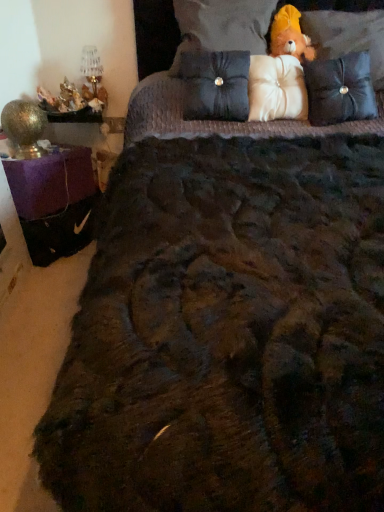
The width and height of the screenshot is (384, 512). Find the location of `velvet-like brown pillow at upper right, the fourth pillow positioned from the left`. velvet-like brown pillow at upper right, the fourth pillow positioned from the left is located at coordinates (340, 89).

Describe the element at coordinates (276, 88) in the screenshot. The image size is (384, 512). I see `white fabric pillow at center, acting as the 3th pillow starting from the left` at that location.

Locate an element on the screen. velvet black pillow at upper right, which ranks as the first pillow in right-to-left order is located at coordinates (348, 36).

Locate an element on the screen. fuzzy brown teddy bear at upper right is located at coordinates (290, 35).

Is white fabric pillow at center, acting as the 3th pillow starting from the left, facing away from fuzzy brown teddy bear at upper right?

white fabric pillow at center, acting as the 3th pillow starting from the left, does not have its back to fuzzy brown teddy bear at upper right.

Starting from the fuzzy brown teddy bear at upper right, which pillow is the 2nd one in front? Please provide its 2D coordinates.

[(276, 88)]

Can you confirm if white fabric pillow at center, acting as the 3th pillow starting from the left, is bigger than fuzzy brown teddy bear at upper right?

Yes.

From a real-world perspective, is white fabric pillow at center, the 3th pillow viewed from the right, above or below fuzzy brown teddy bear at upper right?

white fabric pillow at center, the 3th pillow viewed from the right, is situated lower than fuzzy brown teddy bear at upper right in the real world.

From a real-world perspective, between white fabric pillow at center, acting as the 3th pillow starting from the left, and velvet black pillow at upper right, which appears as the fifth pillow when viewed from the left, who is vertically lower?

From a 3D spatial view, white fabric pillow at center, acting as the 3th pillow starting from the left, is below.

Is white fabric pillow at center, the 3th pillow viewed from the right, positioned with its back to velvet black pillow at upper right, which ranks as the first pillow in right-to-left order?

No, white fabric pillow at center, the 3th pillow viewed from the right,'s orientation is not away from velvet black pillow at upper right, which ranks as the first pillow in right-to-left order.

Which of these two, white fabric pillow at center, acting as the 3th pillow starting from the left, or velvet black pillow at upper right, which appears as the fifth pillow when viewed from the left, stands taller?

velvet black pillow at upper right, which appears as the fifth pillow when viewed from the left, is taller.

From the image's perspective, is white fabric pillow at center, the 3th pillow viewed from the right, located above or below velvet black pillow at upper right, which appears as the fifth pillow when viewed from the left?

white fabric pillow at center, the 3th pillow viewed from the right, is below velvet black pillow at upper right, which appears as the fifth pillow when viewed from the left.

From a real-world perspective, is velvet black pillow at upper right, which appears as the fifth pillow when viewed from the left, physically above fuzzy brown teddy bear at upper right?

Actually, velvet black pillow at upper right, which appears as the fifth pillow when viewed from the left, is physically below fuzzy brown teddy bear at upper right in the real world.

Considering the sizes of velvet black pillow at upper right, which ranks as the first pillow in right-to-left order, and fuzzy brown teddy bear at upper right in the image, is velvet black pillow at upper right, which ranks as the first pillow in right-to-left order, taller or shorter than fuzzy brown teddy bear at upper right?

velvet black pillow at upper right, which ranks as the first pillow in right-to-left order, is taller than fuzzy brown teddy bear at upper right.

Which object is positioned more to the left, velvet black pillow at upper right, which ranks as the first pillow in right-to-left order, or fuzzy brown teddy bear at upper right?

From the viewer's perspective, fuzzy brown teddy bear at upper right appears more on the left side.

From the image's perspective, relative to velvet-like brown pillow at upper right, which is the second pillow in right-to-left order, is fuzzy brown teddy bear at upper right above or below?

From the image's perspective, fuzzy brown teddy bear at upper right appears above velvet-like brown pillow at upper right, which is the second pillow in right-to-left order.

From their relative heights in the image, would you say fuzzy brown teddy bear at upper right is taller or shorter than velvet-like brown pillow at upper right, the fourth pillow positioned from the left?

Considering their sizes, fuzzy brown teddy bear at upper right has less height than velvet-like brown pillow at upper right, the fourth pillow positioned from the left.

From the image's perspective, is velvet-like brown pillow at upper right, the fourth pillow positioned from the left, located above black quilted pillow at center, the first pillow viewed from the left?

No, from the image's perspective, velvet-like brown pillow at upper right, the fourth pillow positioned from the left, is not on top of black quilted pillow at center, the first pillow viewed from the left.

Where is `the 3rd pillow counting from the right side of the black quilted pillow at center, the first pillow viewed from the left`? Image resolution: width=384 pixels, height=512 pixels. the 3rd pillow counting from the right side of the black quilted pillow at center, the first pillow viewed from the left is located at coordinates click(340, 89).

Can you confirm if velvet-like brown pillow at upper right, the fourth pillow positioned from the left, is wider than black quilted pillow at center, the first pillow viewed from the left?

In fact, velvet-like brown pillow at upper right, the fourth pillow positioned from the left, might be narrower than black quilted pillow at center, the first pillow viewed from the left.

Is velvet-like brown pillow at upper right, the fourth pillow positioned from the left, taller than black quilted pillow at center, placed as the 5th pillow when sorted from right to left?

Correct, velvet-like brown pillow at upper right, the fourth pillow positioned from the left, is much taller as black quilted pillow at center, placed as the 5th pillow when sorted from right to left.

From the image's perspective, does velvet-like brown pillow at upper right, which is the second pillow in right-to-left order, appear higher than white fabric pillow at center, acting as the 3th pillow starting from the left?

No, from the image's perspective, velvet-like brown pillow at upper right, which is the second pillow in right-to-left order, is not above white fabric pillow at center, acting as the 3th pillow starting from the left.

Is velvet-like brown pillow at upper right, which is the second pillow in right-to-left order, facing away from white fabric pillow at center, the 3th pillow viewed from the right?

No, white fabric pillow at center, the 3th pillow viewed from the right, is not at the back of velvet-like brown pillow at upper right, which is the second pillow in right-to-left order.

Which of these two, velvet-like brown pillow at upper right, the fourth pillow positioned from the left, or white fabric pillow at center, the 3th pillow viewed from the right, is wider?

white fabric pillow at center, the 3th pillow viewed from the right.

Looking at this image, who is bigger, velvet-like brown pillow at upper right, which is the second pillow in right-to-left order, or velvet black pillow at upper right, which appears as the fifth pillow when viewed from the left?

With larger size is velvet black pillow at upper right, which appears as the fifth pillow when viewed from the left.

Considering the positions of point (352, 99) and point (382, 51), is point (352, 99) closer or farther from the camera than point (382, 51)?

Clearly, point (352, 99) is closer to the camera than point (382, 51).

Is velvet-like brown pillow at upper right, the fourth pillow positioned from the left, facing away from velvet black pillow at upper right, which appears as the fifth pillow when viewed from the left?

That's right, velvet-like brown pillow at upper right, the fourth pillow positioned from the left, is facing away from velvet black pillow at upper right, which appears as the fifth pillow when viewed from the left.

From a real-world perspective, which object rests below the other?

velvet-like brown pillow at upper right, which is the second pillow in right-to-left order, from a real-world perspective.

This screenshot has width=384, height=512. What are the coordinates of `figurine lying behind the white fabric pillow at center, the 3th pillow viewed from the right` in the screenshot? It's located at (290, 35).

What are the coordinates of `the 3rd pillow in front of the white fabric pillow at center, acting as the 3th pillow starting from the left` in the screenshot? It's located at (348, 36).

From the image, which object appears to be farther from black quilted pillow at center, the first pillow viewed from the left, white fabric pillow at center, acting as the 3th pillow starting from the left, or fuzzy brown teddy bear at upper right?

fuzzy brown teddy bear at upper right is further to black quilted pillow at center, the first pillow viewed from the left.

From the image, which object appears to be nearer to fuzzy brown teddy bear at upper right, velvet-like brown pillow at upper right, the fourth pillow positioned from the left, or velvet black pillow at upper right, which appears as the fifth pillow when viewed from the left?

velvet black pillow at upper right, which appears as the fifth pillow when viewed from the left, is closer to fuzzy brown teddy bear at upper right.

Based on their spatial positions, is fuzzy brown teddy bear at upper right or black quilted pillow at center, placed as the 5th pillow when sorted from right to left, further from white fabric pillow at center, acting as the 3th pillow starting from the left?

The object further to white fabric pillow at center, acting as the 3th pillow starting from the left, is fuzzy brown teddy bear at upper right.

Considering their positions, is black quilted pillow at center, placed as the 5th pillow when sorted from right to left, positioned closer to white fabric pillow at center, acting as the 3th pillow starting from the left, than velvet-like brown pillow at upper right, the fourth pillow positioned from the left?

Based on the image, black quilted pillow at center, placed as the 5th pillow when sorted from right to left, appears to be nearer to white fabric pillow at center, acting as the 3th pillow starting from the left.

Based on their spatial positions, is fuzzy brown teddy bear at upper right or black quilted pillow at center, placed as the 5th pillow when sorted from right to left, closer to velvet black pillow at upper right, which appears as the fifth pillow when viewed from the left?

fuzzy brown teddy bear at upper right.

Considering their positions, is fuzzy brown teddy bear at upper right positioned closer to black quilted pillow at center, placed as the 5th pillow when sorted from right to left, than white fabric pillow at center, acting as the 3th pillow starting from the left?

The object closer to black quilted pillow at center, placed as the 5th pillow when sorted from right to left, is white fabric pillow at center, acting as the 3th pillow starting from the left.

Based on their spatial positions, is fuzzy brown teddy bear at upper right or velvet-like brown pillow at upper right, which is the second pillow in right-to-left order, further from velvet black pillow at upper right, which ranks as the first pillow in right-to-left order?

The object further to velvet black pillow at upper right, which ranks as the first pillow in right-to-left order, is fuzzy brown teddy bear at upper right.

Estimate the real-world distances between objects in this image. Which object is further from white satin pillow at upper center, which is the fourth pillow from right to left, velvet black pillow at upper right, which appears as the fifth pillow when viewed from the left, or fuzzy brown teddy bear at upper right?

The object further to white satin pillow at upper center, which is the fourth pillow from right to left, is velvet black pillow at upper right, which appears as the fifth pillow when viewed from the left.

Image resolution: width=384 pixels, height=512 pixels. Find the location of `figurine between white satin pillow at upper center, which is the fourth pillow from right to left, and velvet black pillow at upper right, which appears as the fifth pillow when viewed from the left`. figurine between white satin pillow at upper center, which is the fourth pillow from right to left, and velvet black pillow at upper right, which appears as the fifth pillow when viewed from the left is located at coordinates (290, 35).

Image resolution: width=384 pixels, height=512 pixels. Identify the location of figurine between white fabric pillow at center, acting as the 3th pillow starting from the left, and velvet black pillow at upper right, which ranks as the first pillow in right-to-left order, from left to right. (290, 35).

Find the location of `pillow between fuzzy brown teddy bear at upper right and velvet black pillow at upper right, which ranks as the first pillow in right-to-left order, from left to right`. pillow between fuzzy brown teddy bear at upper right and velvet black pillow at upper right, which ranks as the first pillow in right-to-left order, from left to right is located at coordinates (340, 89).

The image size is (384, 512). Identify the location of pillow between white fabric pillow at center, the 3th pillow viewed from the right, and velvet black pillow at upper right, which ranks as the first pillow in right-to-left order. (340, 89).